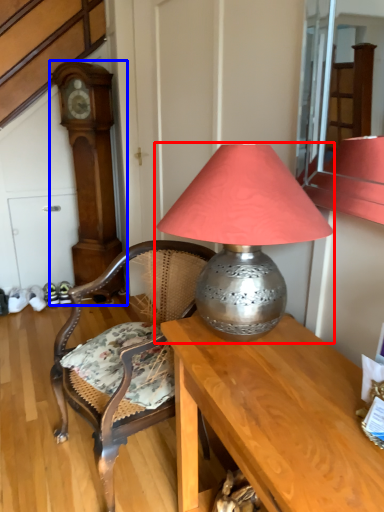
Question: Which object is closer to the camera taking this photo, lamp (highlighted by a red box) or clock (highlighted by a blue box)?

Choices:
 (A) lamp
 (B) clock

Answer: (A)